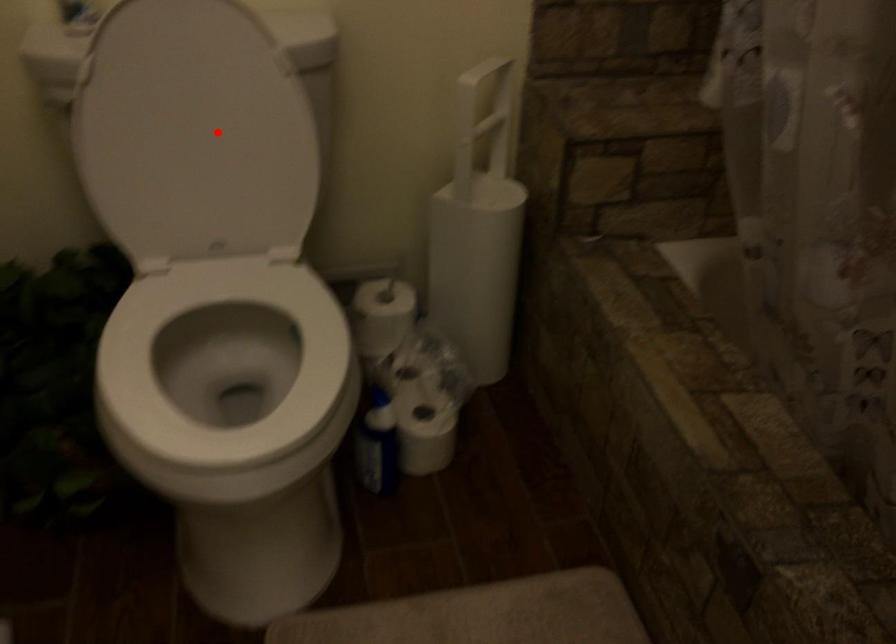
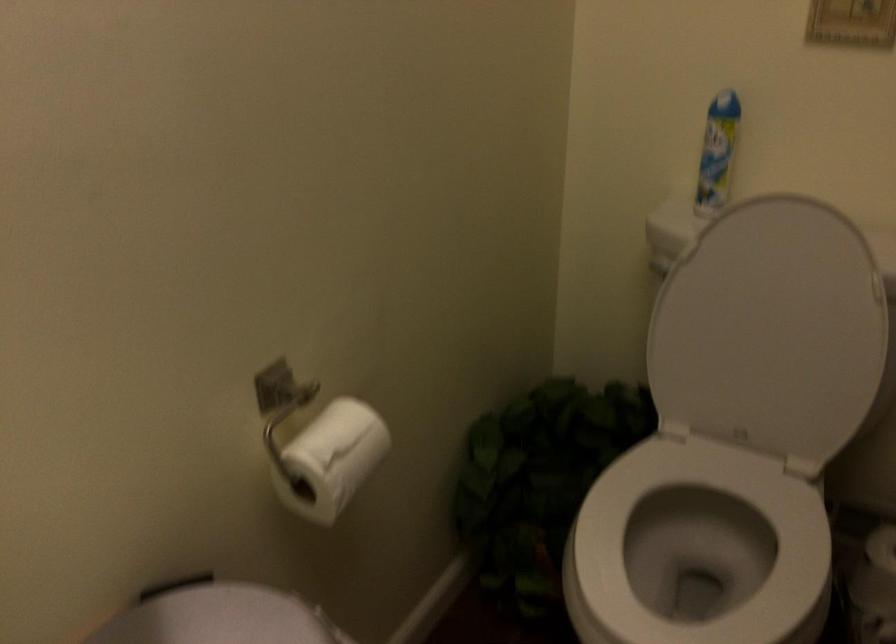
Question: I am providing you with two images of the same scene from different viewpoints. A red point is marked on the first image. Can you still see the location of the red point in image 2?

Choices:
 (A) Yes
 (B) No

Answer: (A)